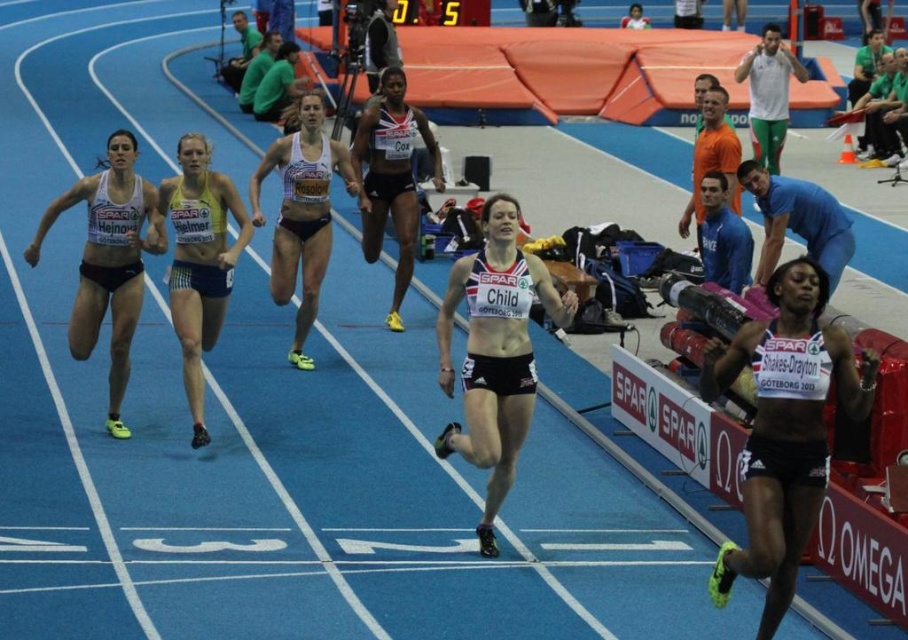
Can you confirm if matte white tank top at left is smaller than blue cotton shirt at upper right?

Actually, matte white tank top at left might be larger than blue cotton shirt at upper right.

Does matte white tank top at left appear under blue cotton shirt at upper right?

Yes.

What do you see at coordinates (107, 260) in the screenshot? I see `matte white tank top at left` at bounding box center [107, 260].

You are a GUI agent. You are given a task and a screenshot of the screen. Output one action in this format:
    pyautogui.click(x=<x>, y=<y>)
    Task: Click on the matte white tank top at left
    
    Given the screenshot: What is the action you would take?
    pyautogui.click(x=107, y=260)

In the scene shown: Does yellow mesh tank top at center have a lesser width compared to matte white tank top at center?

Yes.

Can you confirm if yellow mesh tank top at center is positioned to the left of matte white tank top at center?

Yes, yellow mesh tank top at center is to the left of matte white tank top at center.

The image size is (908, 640). Describe the element at coordinates (199, 260) in the screenshot. I see `yellow mesh tank top at center` at that location.

Where is `yellow mesh tank top at center`? This screenshot has width=908, height=640. yellow mesh tank top at center is located at coordinates (199, 260).

Does black matte shorts at right have a lesser width compared to yellow mesh tank top at center?

In fact, black matte shorts at right might be wider than yellow mesh tank top at center.

Which is above, black matte shorts at right or yellow mesh tank top at center?

yellow mesh tank top at center

Between point (793, 552) and point (211, 284), which one is positioned in front?

Point (793, 552) is more forward.

I want to click on black matte shorts at right, so click(x=785, y=429).